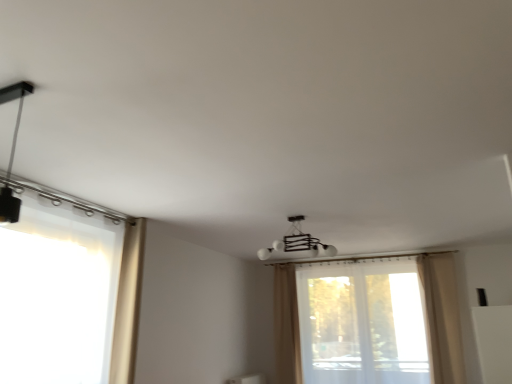
Question: Is white glossy chandelier at center, which ranks as the second lamp in front-to-back order, taller than translucent fabric window at left, placed as the second window when sorted from right to left?

Choices:
 (A) no
 (B) yes

Answer: (A)

Question: Is white glossy chandelier at center, which is counted as the first lamp, starting from the right, aimed at translucent fabric window at left, placed as the 1th window when sorted from front to back?

Choices:
 (A) no
 (B) yes

Answer: (A)

Question: Are white glossy chandelier at center, which is counted as the first lamp, starting from the right, and translucent fabric window at left, placed as the 1th window when sorted from front to back, beside each other?

Choices:
 (A) no
 (B) yes

Answer: (A)

Question: Is white glossy chandelier at center, the 1th lamp in the back-to-front sequence, looking in the opposite direction of translucent fabric window at left, placed as the 2th window when sorted from back to front?

Choices:
 (A) yes
 (B) no

Answer: (B)

Question: Is white glossy chandelier at center, positioned as the 2th lamp in left-to-right order, to the left of translucent fabric window at left, placed as the 1th window when sorted from left to right, from the viewer's perspective?

Choices:
 (A) yes
 (B) no

Answer: (B)

Question: From the image's perspective, is beige fabric curtain at left, which appears as the 3th curtain when viewed from the back, above or below beige fabric curtain at right, the 2th curtain in the back-to-front sequence?

Choices:
 (A) below
 (B) above

Answer: (B)

Question: In terms of width, does beige fabric curtain at left, the 1th curtain in the front-to-back sequence, look wider or thinner when compared to beige fabric curtain at right, the 2th curtain in the back-to-front sequence?

Choices:
 (A) wide
 (B) thin

Answer: (A)

Question: Is beige fabric curtain at left, which appears as the first curtain when viewed from the left, to the left or to the right of beige fabric curtain at right, placed as the 2th curtain when sorted from front to back, in the image?

Choices:
 (A) left
 (B) right

Answer: (A)

Question: Considering the positions of point (136, 228) and point (443, 322), is point (136, 228) closer or farther from the camera than point (443, 322)?

Choices:
 (A) farther
 (B) closer

Answer: (B)

Question: Is beige fabric curtain at left, which appears as the first curtain when viewed from the left, inside or outside of white glossy chandelier at center, positioned as the 2th lamp in left-to-right order?

Choices:
 (A) inside
 (B) outside

Answer: (B)

Question: In the image, is beige fabric curtain at left, which appears as the first curtain when viewed from the left, on the left side or the right side of white glossy chandelier at center, which ranks as the second lamp in front-to-back order?

Choices:
 (A) right
 (B) left

Answer: (B)

Question: From a real-world perspective, is beige fabric curtain at left, which appears as the first curtain when viewed from the left, above or below white glossy chandelier at center, which ranks as the second lamp in front-to-back order?

Choices:
 (A) below
 (B) above

Answer: (A)

Question: Considering the positions of beige fabric curtain at left, which appears as the first curtain when viewed from the left, and white glossy chandelier at center, which ranks as the second lamp in front-to-back order, in the image, is beige fabric curtain at left, which appears as the first curtain when viewed from the left, taller or shorter than white glossy chandelier at center, which ranks as the second lamp in front-to-back order,?

Choices:
 (A) short
 (B) tall

Answer: (B)

Question: From their relative heights in the image, would you say matte black track light at upper left, which is the first lamp from top to bottom, is taller or shorter than transparent fabric window at center, which appears as the 2th window when viewed from the left?

Choices:
 (A) short
 (B) tall

Answer: (A)

Question: Based on their sizes in the image, would you say matte black track light at upper left, which appears as the first lamp when viewed from the left, is bigger or smaller than transparent fabric window at center, the first window viewed from the right?

Choices:
 (A) big
 (B) small

Answer: (B)